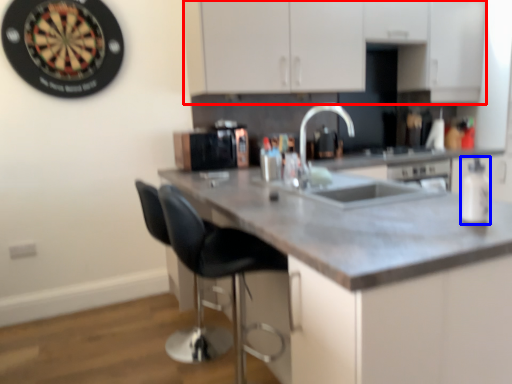
Question: Among these objects, which one is farthest to the camera, cabinetry (highlighted by a red box) or bottle (highlighted by a blue box)?

Choices:
 (A) cabinetry
 (B) bottle

Answer: (A)